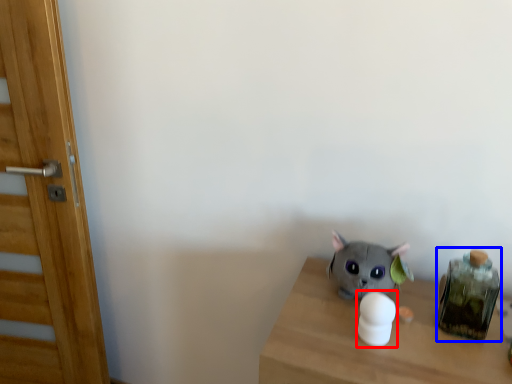
Question: Which of the following is the closest to the observer, toy (highlighted by a red box) or glass jar (highlighted by a blue box)?

Choices:
 (A) toy
 (B) glass jar

Answer: (A)